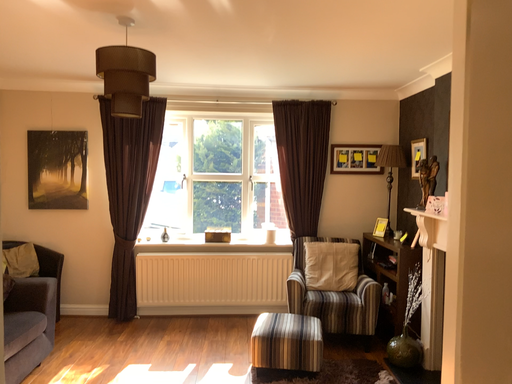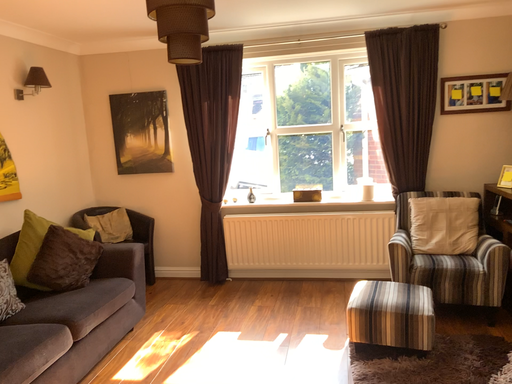
Question: How did the camera likely rotate when shooting the video?

Choices:
 (A) rotated upward
 (B) rotated downward

Answer: (B)